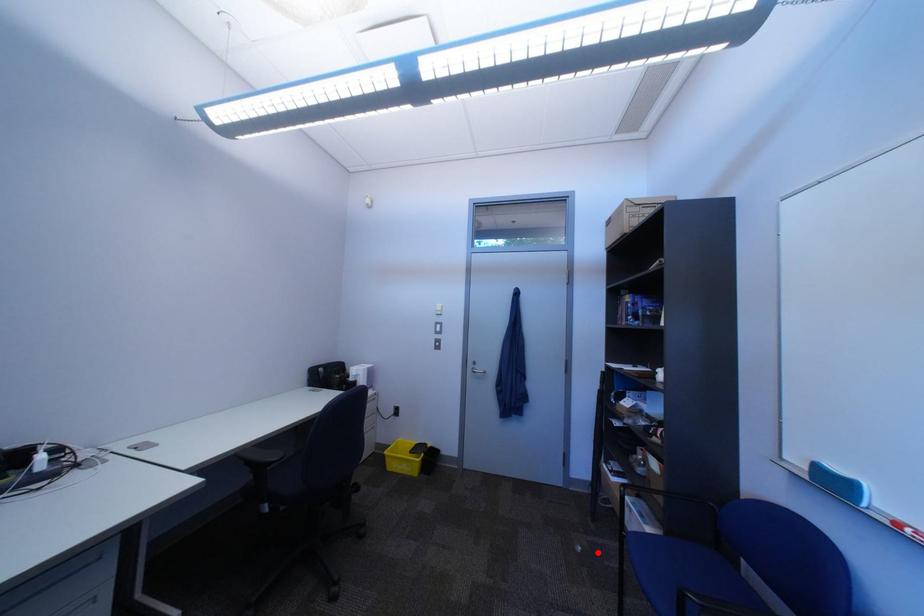
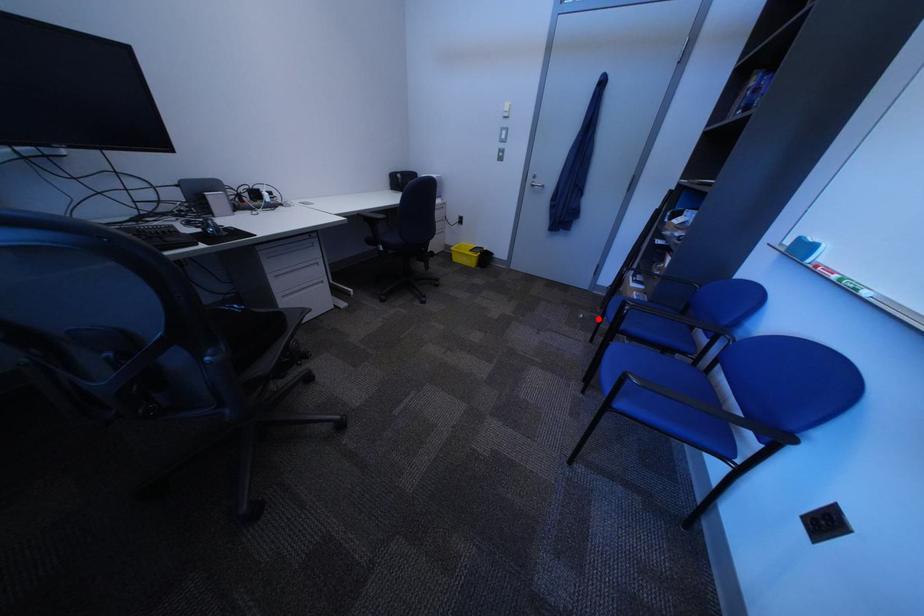
I am providing you with two images of the same scene from different viewpoints. A red point is marked on the first image and another point is marked on the second image. Does the point marked in image1 correspond to the same location as the one in image2?

Yes